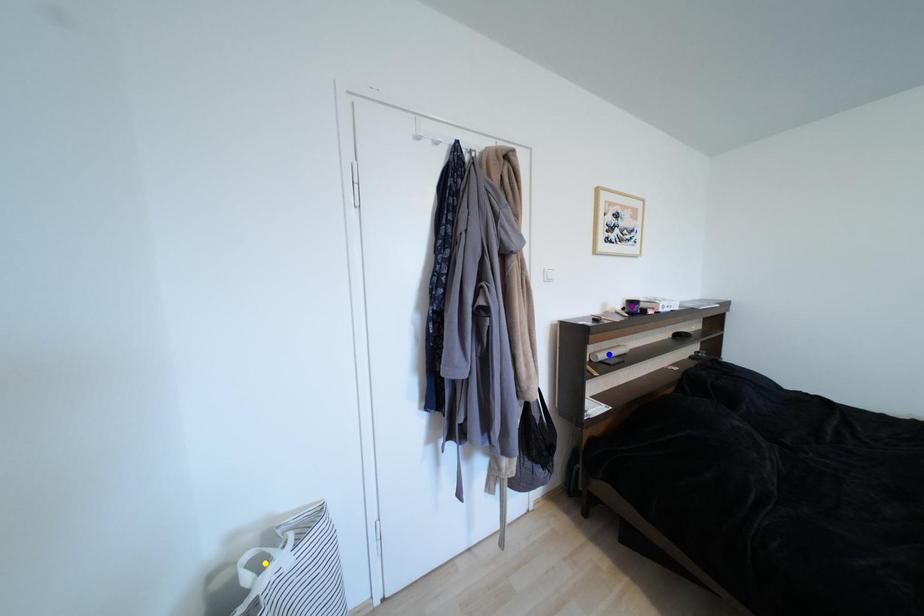
Order these from nearest to farthest:
1. blue point
2. yellow point
3. purple point

yellow point, blue point, purple point